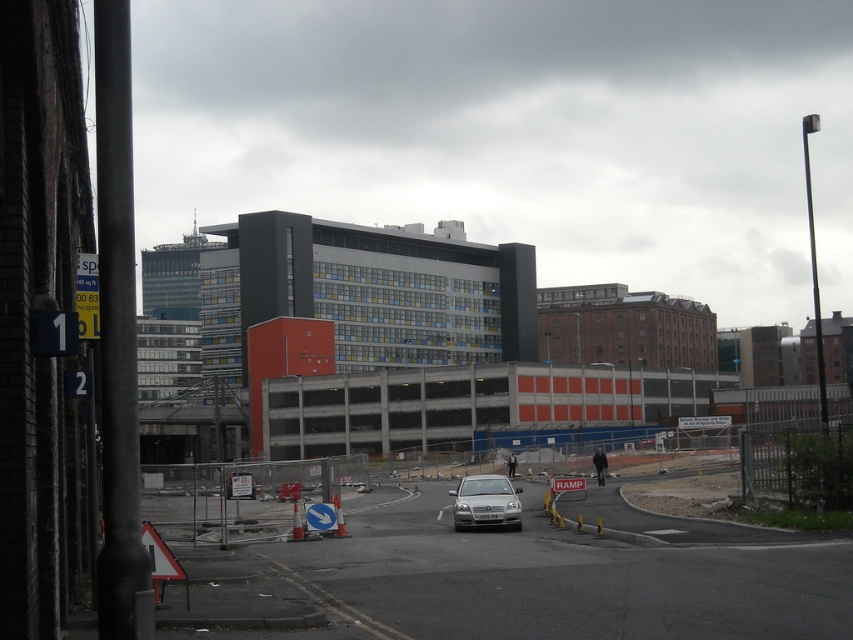
Question: Does concrete fence at lower left have a lesser width compared to satin silver car at center?

Choices:
 (A) no
 (B) yes

Answer: (A)

Question: Which object is farther from the camera taking this photo?

Choices:
 (A) concrete fence at lower left
 (B) satin silver car at center

Answer: (B)

Question: Which object is farther from the camera taking this photo?

Choices:
 (A) concrete fence at lower left
 (B) satin silver car at center

Answer: (B)

Question: Does concrete fence at lower left appear over satin silver car at center?

Choices:
 (A) yes
 (B) no

Answer: (A)

Question: Is concrete fence at lower left positioned behind satin silver car at center?

Choices:
 (A) yes
 (B) no

Answer: (B)